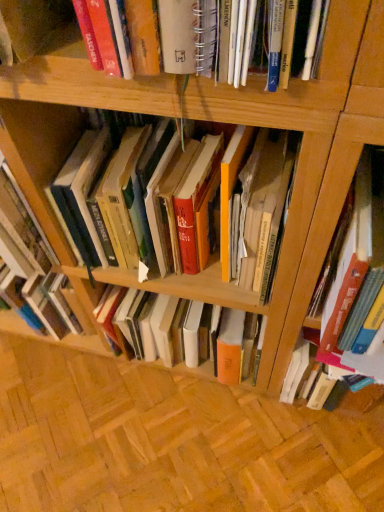
Question: Does hardcover book at right, the second book viewed from the right, touch hardcover book at right, which is the third book in left-to-right order?

Choices:
 (A) no
 (B) yes

Answer: (A)

Question: Is hardcover book at right, marked as the 2th book in a left-to-right arrangement, in front of hardcover book at right, the 1th book from the right?

Choices:
 (A) no
 (B) yes

Answer: (B)

Question: Is hardcover book at right, which is the third book in left-to-right order, surrounded by hardcover book at right, marked as the 2th book in a left-to-right arrangement?

Choices:
 (A) no
 (B) yes

Answer: (A)

Question: From the image's perspective, is hardcover book at right, the second book viewed from the right, located beneath hardcover book at right, the 1th book from the right?

Choices:
 (A) no
 (B) yes

Answer: (A)

Question: Is hardcover book at right, the second book viewed from the right, taller than hardcover book at right, which is the third book in left-to-right order?

Choices:
 (A) no
 (B) yes

Answer: (B)

Question: From the image's perspective, is hardcover book at center, the first book from the left, positioned above or below hardcover book at right, the 1th book from the right?

Choices:
 (A) below
 (B) above

Answer: (B)

Question: From their relative heights in the image, would you say hardcover book at center, the first book from the left, is taller or shorter than hardcover book at right, which is the third book in left-to-right order?

Choices:
 (A) short
 (B) tall

Answer: (B)

Question: Is point click(x=130, y=263) positioned closer to the camera than point click(x=309, y=374)?

Choices:
 (A) farther
 (B) closer

Answer: (B)

Question: Looking at their shapes, would you say hardcover book at center, the first book from the left, is wider or thinner than hardcover book at right, which is the third book in left-to-right order?

Choices:
 (A) wide
 (B) thin

Answer: (A)

Question: Is hardcover book at right, which is the third book in left-to-right order, bigger or smaller than hardcover book at right, the second book viewed from the right?

Choices:
 (A) small
 (B) big

Answer: (A)

Question: From their relative heights in the image, would you say hardcover book at right, which is the third book in left-to-right order, is taller or shorter than hardcover book at right, marked as the 2th book in a left-to-right arrangement?

Choices:
 (A) short
 (B) tall

Answer: (A)

Question: From the image's perspective, relative to hardcover book at right, marked as the 2th book in a left-to-right arrangement, is hardcover book at right, which is the third book in left-to-right order, above or below?

Choices:
 (A) below
 (B) above

Answer: (A)

Question: Considering the positions of hardcover book at right, which is the third book in left-to-right order, and hardcover book at right, the second book viewed from the right, in the image, is hardcover book at right, which is the third book in left-to-right order, wider or thinner than hardcover book at right, the second book viewed from the right,?

Choices:
 (A) thin
 (B) wide

Answer: (A)

Question: Is hardcover book at right, marked as the 2th book in a left-to-right arrangement, inside or outside of hardcover book at center, which appears as the third book when viewed from the right?

Choices:
 (A) outside
 (B) inside

Answer: (A)

Question: From the image's perspective, is hardcover book at right, marked as the 2th book in a left-to-right arrangement, above or below hardcover book at center, the first book from the left?

Choices:
 (A) above
 (B) below

Answer: (B)